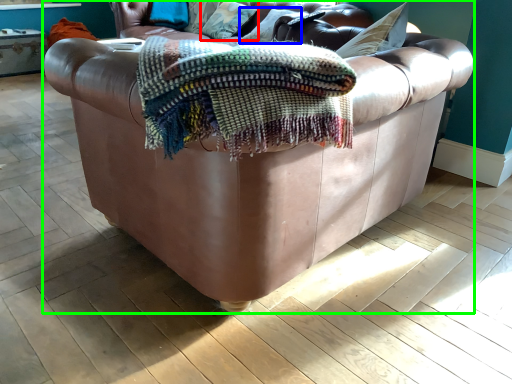
Question: Considering the real-world distances, which object is closest to pillow (highlighted by a red box)? pillow (highlighted by a blue box) or studio couch (highlighted by a green box).

Choices:
 (A) pillow
 (B) studio couch

Answer: (A)